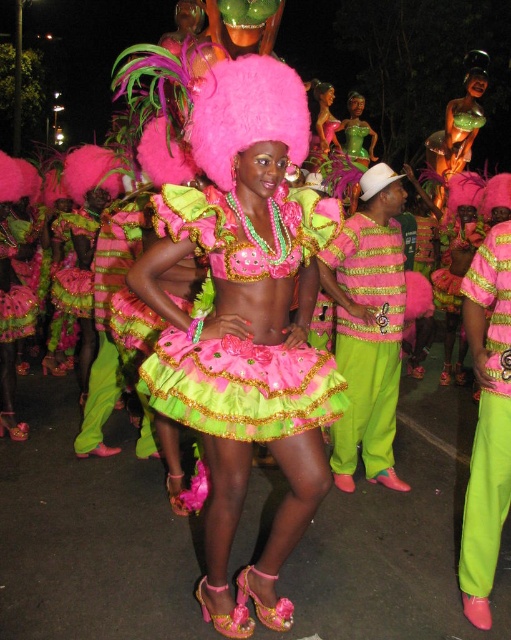
Question: In this image, where is shiny satin dress at center located relative to matte pink fabric dress at center?

Choices:
 (A) left
 (B) right

Answer: (A)

Question: Does matte pink fabric dress at center appear on the left side of neon green satin pants at lower right?

Choices:
 (A) yes
 (B) no

Answer: (A)

Question: Which object appears farthest from the camera in this image?

Choices:
 (A) shiny satin dress at center
 (B) neon green satin pants at lower right
 (C) matte pink fabric dress at center
 (D) lime green satin pants at right

Answer: (D)

Question: Can you confirm if matte pink fabric dress at center is smaller than lime green satin pants at right?

Choices:
 (A) no
 (B) yes

Answer: (B)

Question: Based on their relative distances, which object is farther from the matte pink fabric dress at center?

Choices:
 (A) lime green satin pants at right
 (B) shiny satin dress at center

Answer: (A)

Question: Estimate the real-world distances between objects in this image. Which object is farther from the lime green satin pants at right?

Choices:
 (A) matte pink fabric dress at center
 (B) neon green satin pants at lower right
 (C) shiny satin dress at center

Answer: (C)